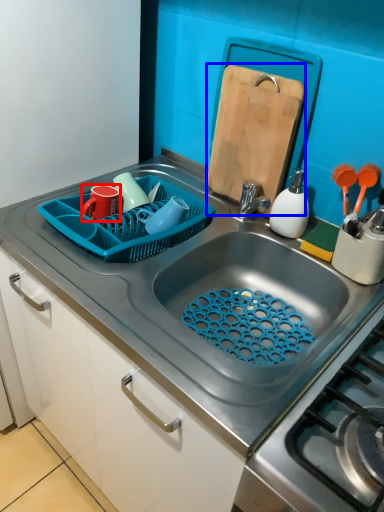
Question: Which object appears closest to the camera in this image, tableware (highlighted by a red box) or cutting board (highlighted by a blue box)?

Choices:
 (A) tableware
 (B) cutting board

Answer: (B)